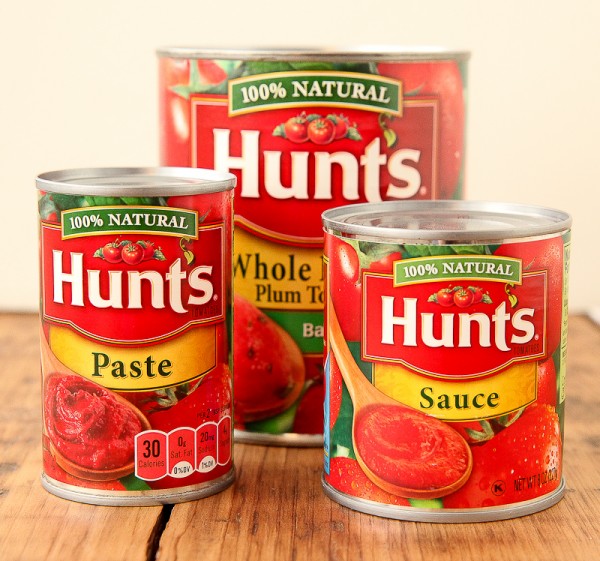
Find the location of a particular element. The width and height of the screenshot is (600, 561). wooden tabletop is located at coordinates (238, 528).